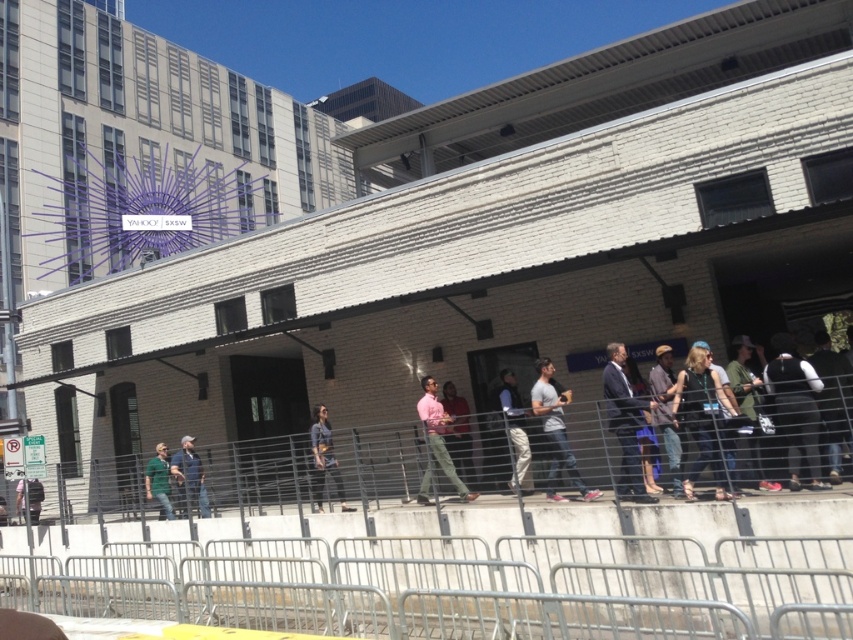
You are a photographer trying to capture a clear shot of the YAHOO! SXSW graphic on the building. You notice two people wearing a light gray cotton shirt at center and dark gray jeans at center. Which clothing item is taller in the photo?

The light gray cotton shirt at center is taller than the dark gray jeans at center.

You are standing in front of the building with the purple sunburst graphic. You notice two points marked on the concrete barrier in front of the building. The first point is at coordinate (x=740, y=362) and the second is at (x=674, y=477). If you want to place a small flag closer to the building, which point should you choose?

You should choose point (x=674, y=477) because it is closer to the building than point (x=740, y=362), which is further away from the building.